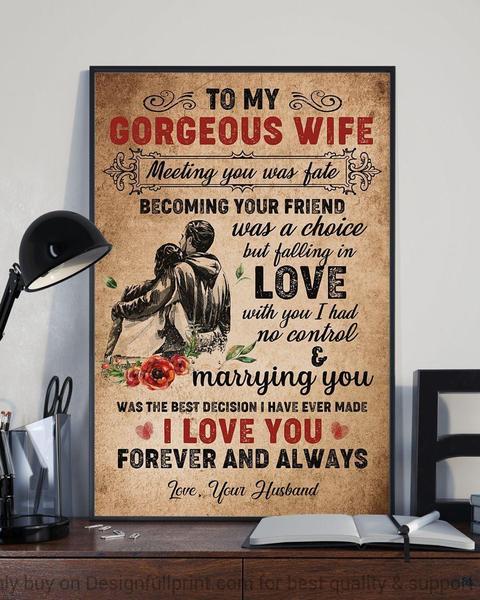
Locate an element on the screen. This screenshot has width=480, height=600. poster is located at coordinates (365, 420).